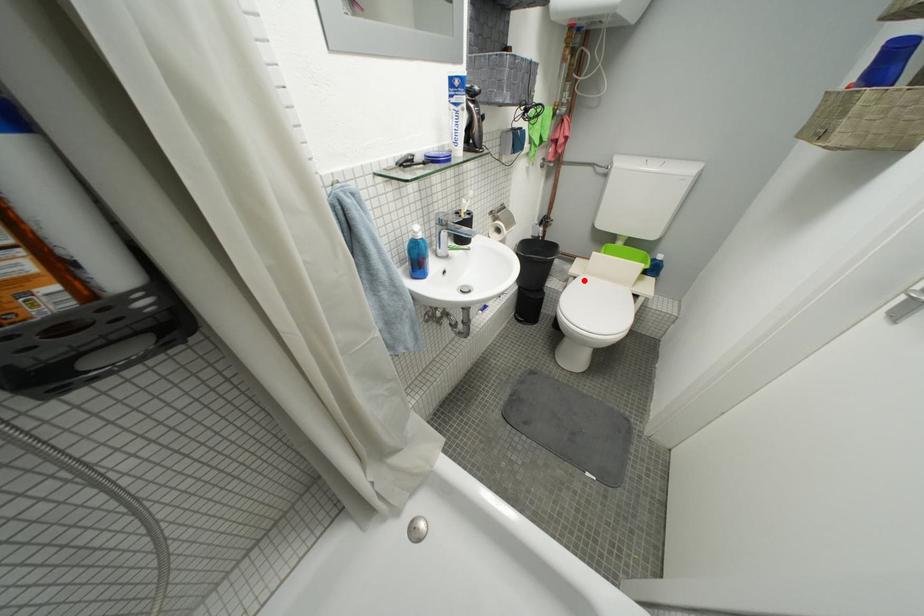
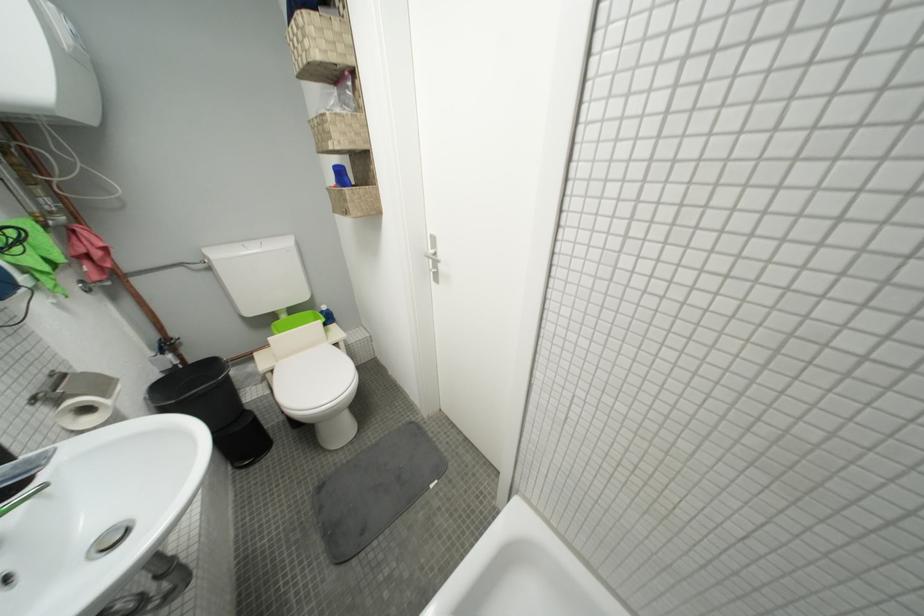
Question: I am providing you with two images of the same scene from different viewpoints. Image1 has a red point marked. In image2, the corresponding 3D location appears at what relative position? Reply with the corresponding letter.

Choices:
 (A) Closer
 (B) Farther

Answer: (B)